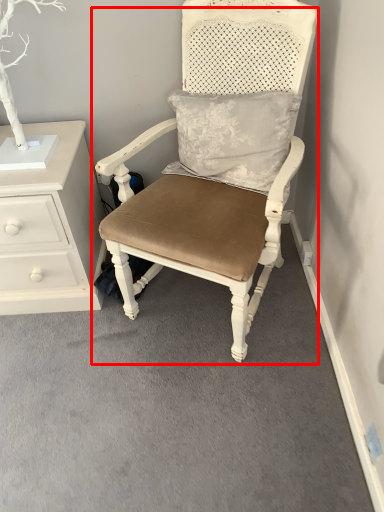
Question: Observing the image, what is the correct spatial positioning of chair (annotated by the red box) in reference to chest of drawers?

Choices:
 (A) left
 (B) right

Answer: (B)